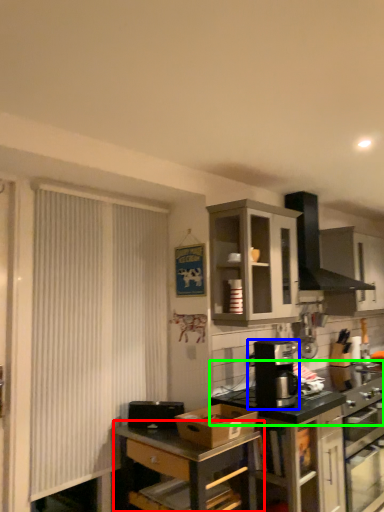
Question: Based on their relative distances, which object is nearer to table (highlighted by a red box)? Choose from kitchen appliance (highlighted by a blue box) and countertop (highlighted by a green box).

Choices:
 (A) kitchen appliance
 (B) countertop

Answer: (A)